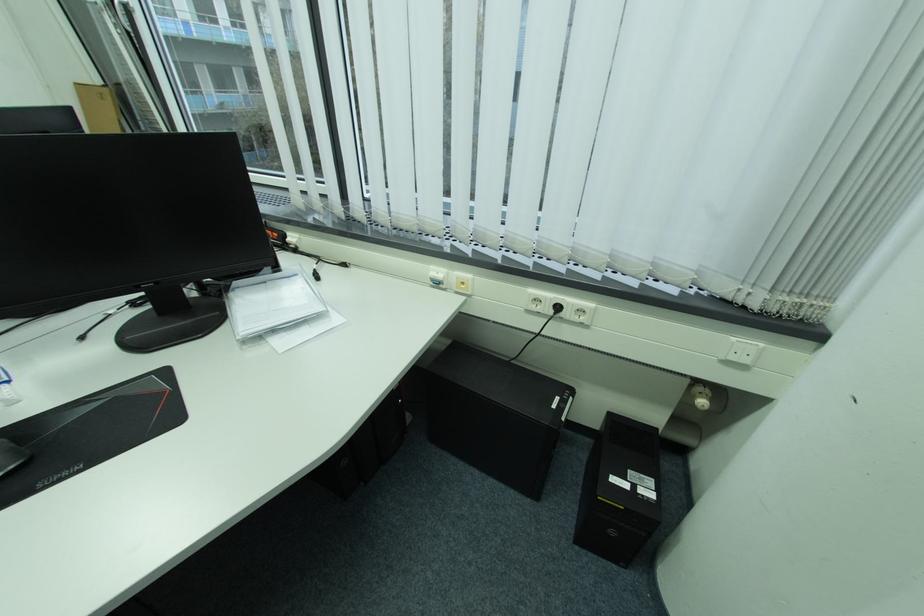
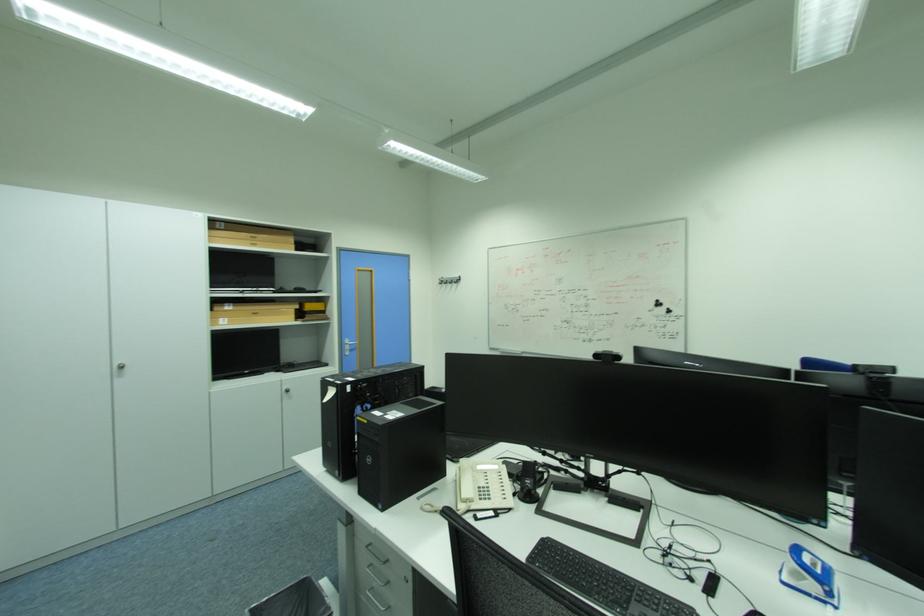
Question: The camera is either moving clockwise (left) or counter-clockwise (right) around the object. The first image is from the beginning of the video and the second image is from the end. Is the camera moving left or right when shooting the video?

Choices:
 (A) Left
 (B) Right

Answer: (B)